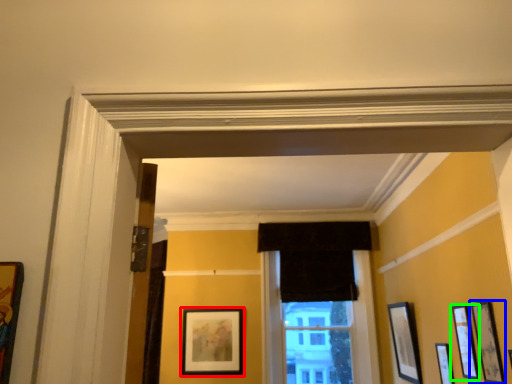
Question: Considering the real-world distances, which object is farthest from picture frame (highlighted by a red box)? picture frame (highlighted by a blue box) or picture frame (highlighted by a green box)?

Choices:
 (A) picture frame
 (B) picture frame

Answer: (A)